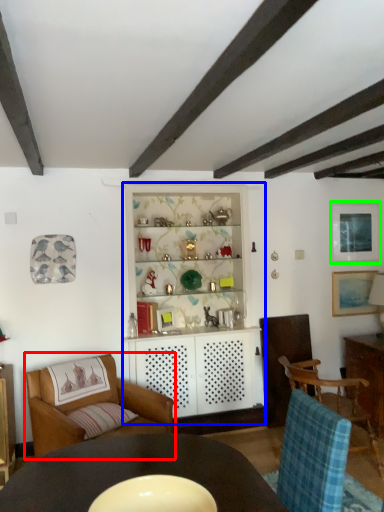
Question: Which object is positioned farthest from chair (highlighted by a red box)? Select from dresser (highlighted by a blue box) and picture frame (highlighted by a green box).

Choices:
 (A) dresser
 (B) picture frame

Answer: (B)